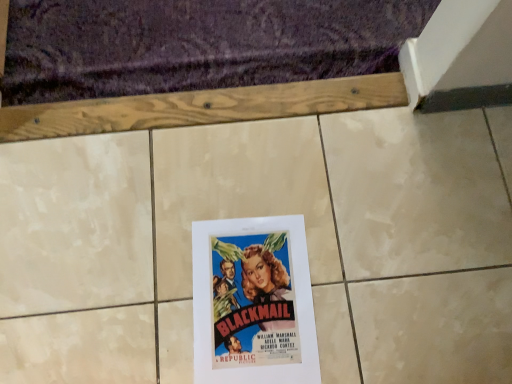
Where is `vacant space to the right of matte paper poster at center`? vacant space to the right of matte paper poster at center is located at coordinates (370, 278).